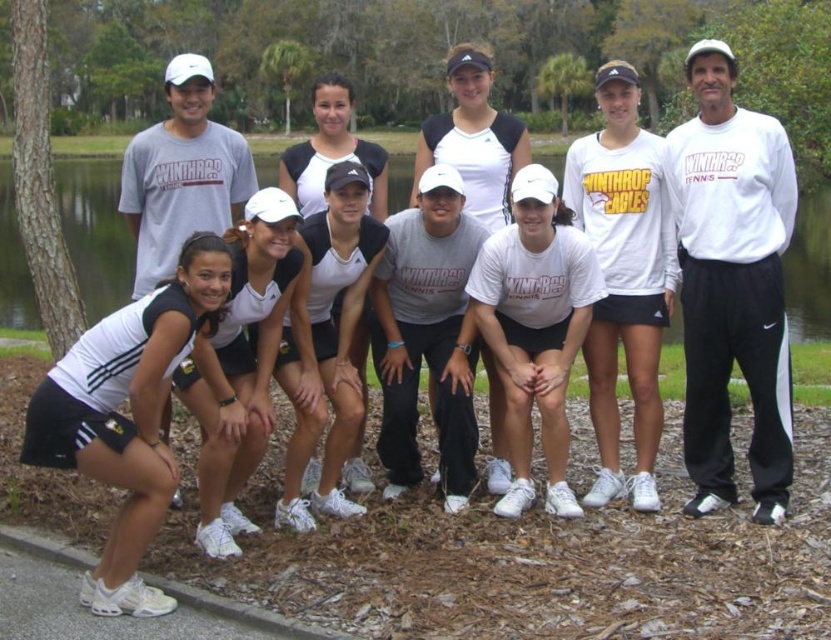
Question: Among these points, which one is farthest from the camera?

Choices:
 (A) (549, 168)
 (B) (701, 120)
 (C) (207, 96)

Answer: (A)

Question: Which object is closer to the camera taking this photo?

Choices:
 (A) green water at lower left
 (B) white matte sweatshirt at upper right
 (C) white cotton t-shirt at center

Answer: (C)

Question: Is white matte sweatshirt at upper right bigger than white cotton t-shirt at center?

Choices:
 (A) yes
 (B) no

Answer: (B)

Question: Can you confirm if green water at lower left is wider than white cotton t-shirt at center?

Choices:
 (A) yes
 (B) no

Answer: (A)

Question: Can you confirm if green water at lower left is positioned above white cotton t-shirt at center?

Choices:
 (A) no
 (B) yes

Answer: (B)

Question: Which point is farther to the camera?

Choices:
 (A) white matte sweatshirt at upper right
 (B) white cotton t-shirt at center
 (C) green water at lower left

Answer: (C)